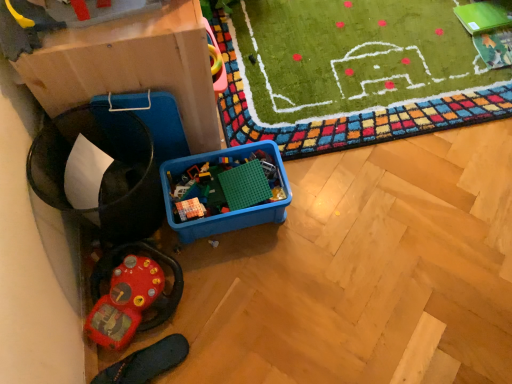
Question: Is rubberized red steering wheel at lower left, acting as the 1th toy starting from the left, at the left side of matte cardboard box at left?

Choices:
 (A) yes
 (B) no

Answer: (B)

Question: From a real-world perspective, is rubberized red steering wheel at lower left, arranged as the 2th toy when viewed from the top, positioned over matte cardboard box at left based on gravity?

Choices:
 (A) yes
 (B) no

Answer: (B)

Question: Does rubberized red steering wheel at lower left, which ranks as the first toy in bottom-to-top order, have a smaller size compared to matte cardboard box at left?

Choices:
 (A) no
 (B) yes

Answer: (B)

Question: From the image's perspective, does rubberized red steering wheel at lower left, arranged as the 2th toy when viewed from the top, appear lower than matte cardboard box at left?

Choices:
 (A) yes
 (B) no

Answer: (A)

Question: Considering the relative positions of rubberized red steering wheel at lower left, which appears as the second toy when viewed from the right, and matte cardboard box at left in the image provided, is rubberized red steering wheel at lower left, which appears as the second toy when viewed from the right, in front of matte cardboard box at left?

Choices:
 (A) no
 (B) yes

Answer: (A)

Question: Is rubberized red steering wheel at lower left, acting as the 1th toy starting from the left, oriented away from matte cardboard box at left?

Choices:
 (A) no
 (B) yes

Answer: (A)

Question: Is rubberized red steering wheel at lower left, arranged as the 2th toy when viewed from the top, at the back of blue plastic container at center, placed as the first toy when sorted from right to left?

Choices:
 (A) no
 (B) yes

Answer: (A)

Question: Could rubberized red steering wheel at lower left, which ranks as the first toy in bottom-to-top order, be considered to be inside blue plastic container at center, which ranks as the 2th toy in left-to-right order?

Choices:
 (A) no
 (B) yes

Answer: (A)

Question: Does blue plastic container at center, placed as the first toy when sorted from right to left, lie in front of rubberized red steering wheel at lower left, which ranks as the first toy in bottom-to-top order?

Choices:
 (A) no
 (B) yes

Answer: (A)

Question: Can you confirm if blue plastic container at center, which is the 2th toy in bottom-to-top order, is smaller than rubberized red steering wheel at lower left, which ranks as the first toy in bottom-to-top order?

Choices:
 (A) no
 (B) yes

Answer: (A)

Question: Considering the relative sizes of blue plastic container at center, placed as the first toy when sorted from right to left, and rubberized red steering wheel at lower left, which ranks as the first toy in bottom-to-top order, in the image provided, is blue plastic container at center, placed as the first toy when sorted from right to left, wider than rubberized red steering wheel at lower left, which ranks as the first toy in bottom-to-top order,?

Choices:
 (A) yes
 (B) no

Answer: (A)

Question: Considering the relative sizes of blue plastic container at center, placed as the first toy when sorted from right to left, and rubberized red steering wheel at lower left, acting as the 1th toy starting from the left, in the image provided, is blue plastic container at center, placed as the first toy when sorted from right to left, thinner than rubberized red steering wheel at lower left, acting as the 1th toy starting from the left,?

Choices:
 (A) no
 (B) yes

Answer: (A)

Question: Is rubberized red steering wheel at lower left, which appears as the second toy when viewed from the right, aimed at blue plastic container at center, which ranks as the 2th toy in left-to-right order?

Choices:
 (A) yes
 (B) no

Answer: (A)